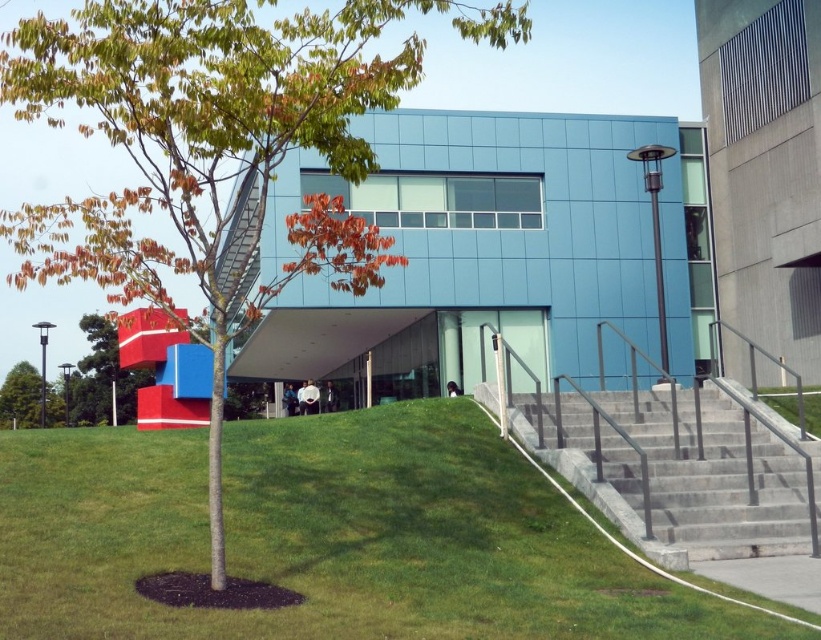
Is point (99, 113) positioned in front of point (612, 472)?

No, it is behind (612, 472).

Identify the location of green leafy tree at center. This screenshot has height=640, width=821. (214, 150).

Is green grassy at lower left bigger than green leafy tree at left?

Incorrect, green grassy at lower left is not larger than green leafy tree at left.

Does green grassy at lower left come behind green leafy tree at left?

No, green grassy at lower left is closer to the viewer.

Which is behind, point (384, 605) or point (21, 413)?

Point (21, 413)

Find the location of a particular element. The height and width of the screenshot is (640, 821). green grassy at lower left is located at coordinates (328, 536).

Is green grassy at lower left closer to camera compared to smooth red cube at left?

Yes, it is in front of smooth red cube at left.

What are the coordinates of `green grassy at lower left` in the screenshot? It's located at (328, 536).